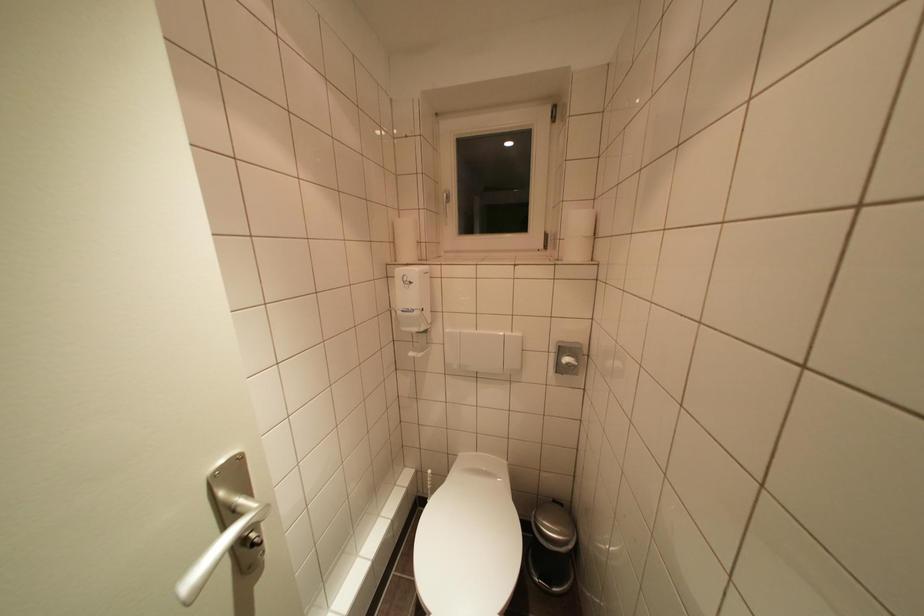
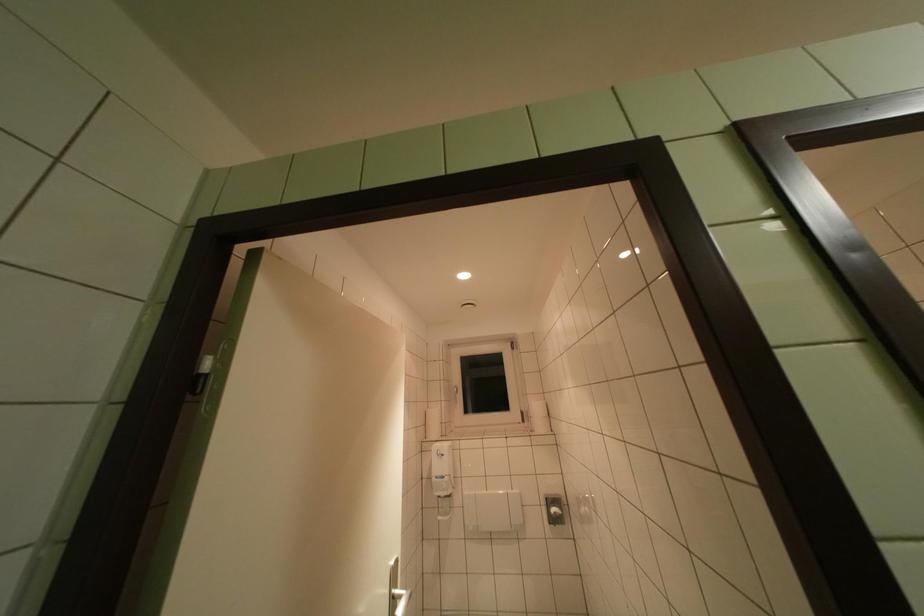
Question: Based on the continuous images, in which direction is the camera rotating? Reply with the corresponding letter.

Choices:
 (A) Left
 (B) Right
 (C) Up
 (D) Down

Answer: (C)